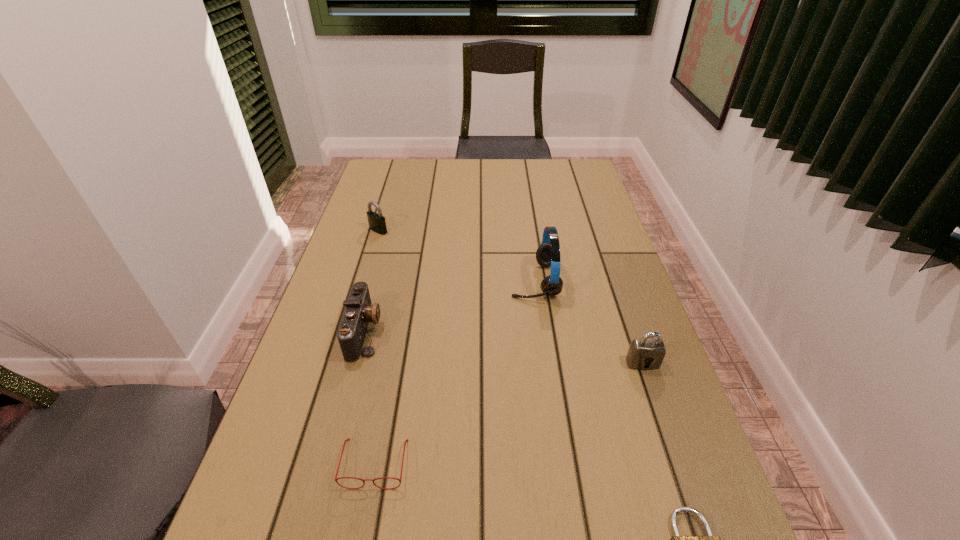
Locate an element on the screen. The image size is (960, 540). vacant space at the right edge is located at coordinates (599, 219).

Find the location of a particular element. The height and width of the screenshot is (540, 960). vacant position at the far left corner of the desktop is located at coordinates (369, 186).

This screenshot has height=540, width=960. I want to click on vacant area between the fifth tallest object and the camera, so click(370, 397).

At what (x,y) coordinates should I click in order to perform the action: click on vacant space that is in between the second nearest padlock and the headset. Please return your answer as a coordinate pair (x, y). Looking at the image, I should click on (588, 322).

Where is `empty space that is in between the second nearest padlock and the camera`? Image resolution: width=960 pixels, height=540 pixels. empty space that is in between the second nearest padlock and the camera is located at coordinates (504, 347).

Locate an element on the screen. The image size is (960, 540). vacant area that lies between the camera and the spectacles is located at coordinates (370, 397).

In order to click on vacant space that's between the second nearest padlock and the fourth object from left to right in this screenshot , I will do `click(588, 322)`.

At what (x,y) coordinates should I click in order to perform the action: click on empty location between the farthest object and the second nearest object. Please return your answer as a coordinate pair (x, y). This screenshot has height=540, width=960. Looking at the image, I should click on (376, 347).

Where is `the third closest object to the camera`? The width and height of the screenshot is (960, 540). the third closest object to the camera is located at coordinates (548, 253).

At what (x,y) coordinates should I click in order to perform the action: click on object that stands as the fourth closest to the spectacles. Please return your answer as a coordinate pair (x, y). The height and width of the screenshot is (540, 960). Looking at the image, I should click on (647, 353).